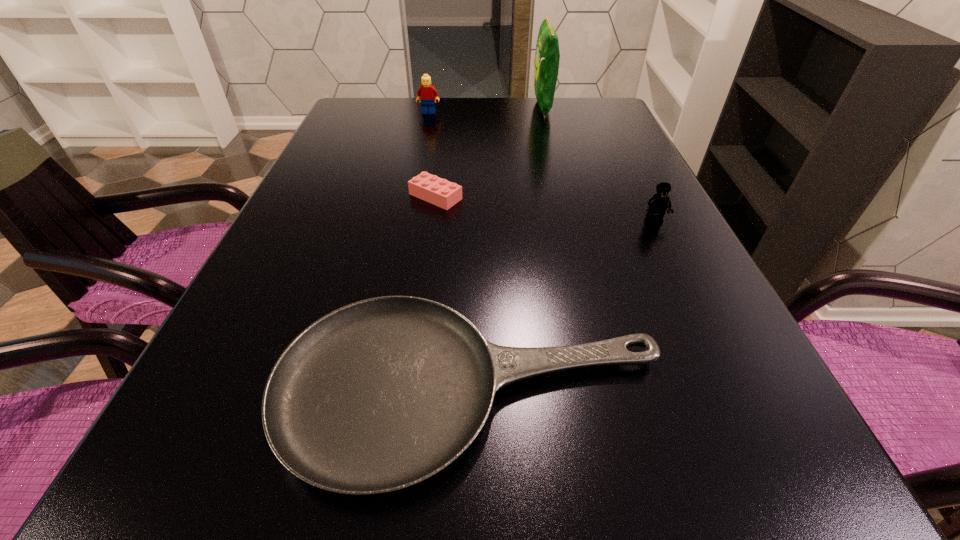
The width and height of the screenshot is (960, 540). I want to click on Lego that is positioned at the right edge, so click(657, 205).

The image size is (960, 540). Find the location of `frying pan located at the right edge`. frying pan located at the right edge is located at coordinates (378, 395).

At what (x,y) coordinates should I click in order to perform the action: click on object situated at the near left corner. Please return your answer as a coordinate pair (x, y). Looking at the image, I should click on (378, 395).

This screenshot has width=960, height=540. In order to click on object that is at the near right corner in this screenshot , I will do `click(378, 395)`.

At what (x,y) coordinates should I click in order to perform the action: click on vacant space at the far edge. Please return your answer as a coordinate pair (x, y). Looking at the image, I should click on (399, 118).

Where is `blank area at the near edge`? The image size is (960, 540). blank area at the near edge is located at coordinates (658, 497).

Where is `vacant region at the left edge of the desktop`? vacant region at the left edge of the desktop is located at coordinates (288, 232).

In order to click on vacant space at the right edge in this screenshot , I will do `click(595, 162)`.

Where is `free space at the far left corner of the desktop`? free space at the far left corner of the desktop is located at coordinates (348, 110).

Identify the location of free space at the near left corner of the desktop. (139, 532).